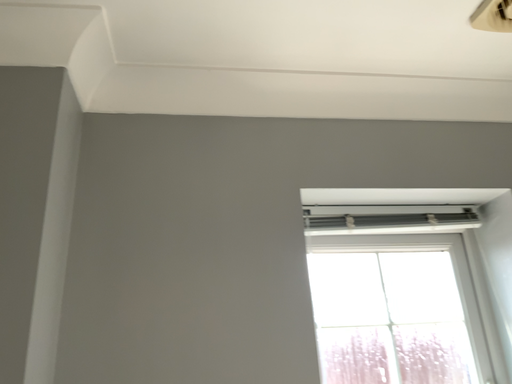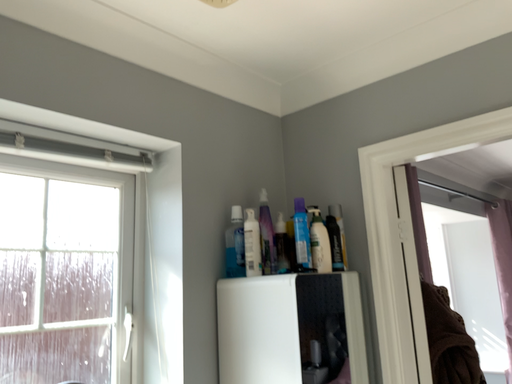
Question: How did the camera likely rotate when shooting the video?

Choices:
 (A) rotated left
 (B) rotated right

Answer: (B)